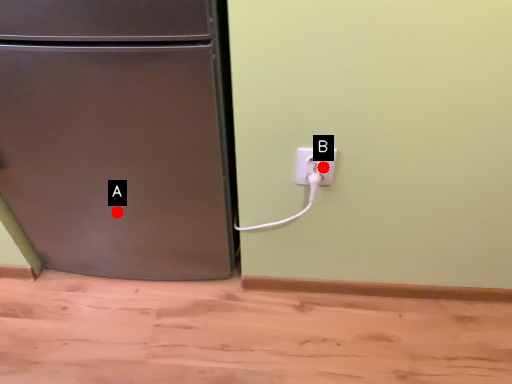
Question: Two points are circled on the image, labeled by A and B beside each circle. Which of the following is the closest to the observer?

Choices:
 (A) A is closer
 (B) B is closer

Answer: (B)